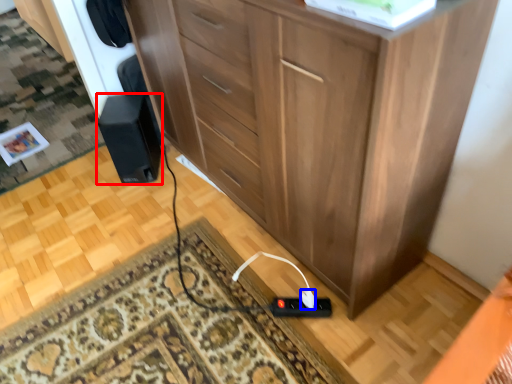
Question: Which object appears closest to the camera in this image, speaker (highlighted by a red box) or plug (highlighted by a blue box)?

Choices:
 (A) speaker
 (B) plug

Answer: (B)